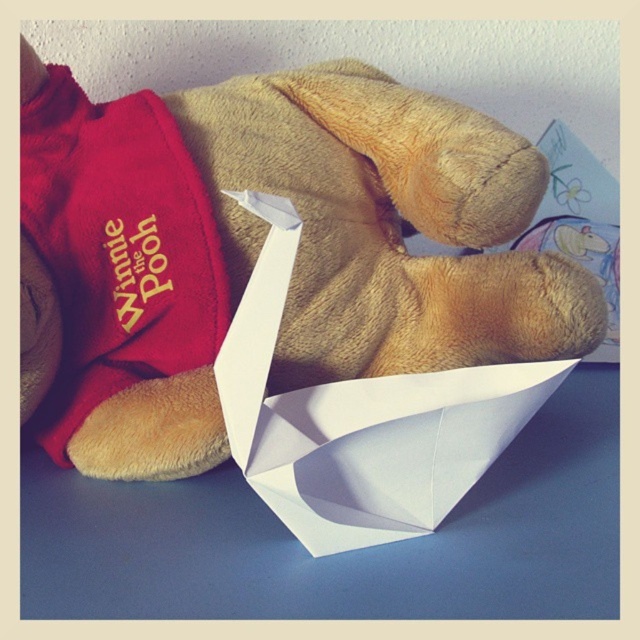
Question: Does soft plush teddy bear at center have a lesser width compared to white paper boat at center?

Choices:
 (A) no
 (B) yes

Answer: (A)

Question: Can you confirm if soft plush teddy bear at center is positioned above white paper boat at center?

Choices:
 (A) no
 (B) yes

Answer: (B)

Question: Does soft plush teddy bear at center lie behind white paper boat at center?

Choices:
 (A) no
 (B) yes

Answer: (B)

Question: Among these objects, which one is nearest to the camera?

Choices:
 (A) white paper boat at center
 (B) soft plush teddy bear at center

Answer: (A)